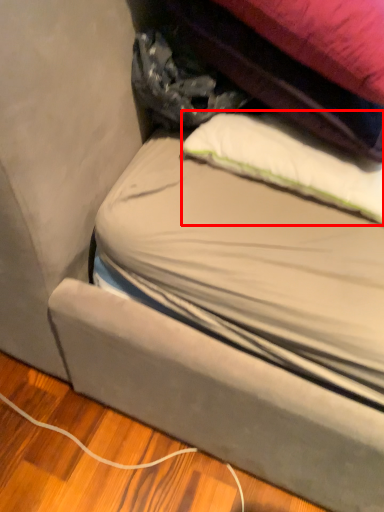
Question: From the image's perspective, considering the relative positions of pillow (annotated by the red box) and bag in the image provided, where is pillow (annotated by the red box) located with respect to the staircase?

Choices:
 (A) above
 (B) below

Answer: (B)